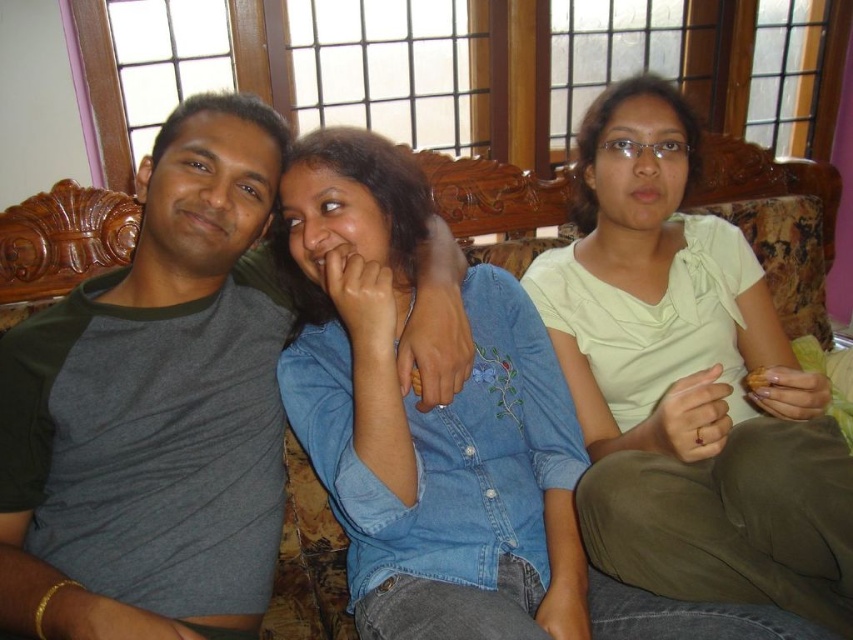
You are standing in the room and want to know how far the point at coordinates (198,99) is from you. Can you determine the distance?

The point at coordinates (198,99) is 1.10 meters away from you.